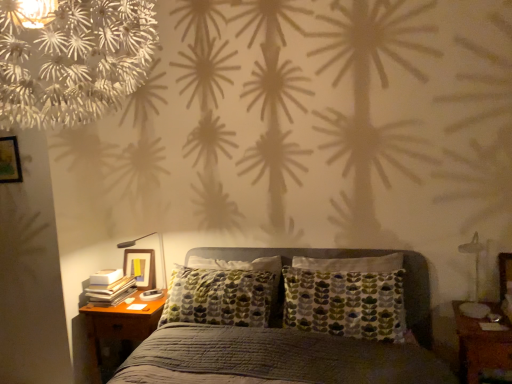
The height and width of the screenshot is (384, 512). In order to click on brown wooden nightstand at lower right, the first nightstand positioned from the right in this screenshot , I will do click(x=481, y=344).

In order to face matte black lamp at left, the 2th bedside lamp in the right-to-left sequence, should I rotate leftwards or rightwards?

Rotate your view left by about 15.663°.

Where is `wooden nightstand at lower left, placed as the 2th nightstand when sorted from front to back`? The width and height of the screenshot is (512, 384). wooden nightstand at lower left, placed as the 2th nightstand when sorted from front to back is located at coordinates point(119,326).

Image resolution: width=512 pixels, height=384 pixels. Describe the element at coordinates (119, 326) in the screenshot. I see `wooden nightstand at lower left, which ranks as the 1th nightstand in back-to-front order` at that location.

Locate an element on the screen. This screenshot has height=384, width=512. brown wooden nightstand at lower right, the first nightstand positioned from the front is located at coordinates (481, 344).

Which point is more distant from viewer, [471,380] or [257,359]?

The point [471,380] is farther.

Does brown wooden nightstand at lower right, which ranks as the second nightstand in back-to-front order, have a lesser height compared to textured gray bed at center?

Correct, brown wooden nightstand at lower right, which ranks as the second nightstand in back-to-front order, is not as tall as textured gray bed at center.

Considering the positions of objects brown wooden nightstand at lower right, the second nightstand when ordered from left to right, and textured gray bed at center in the image provided, who is in front, brown wooden nightstand at lower right, the second nightstand when ordered from left to right, or textured gray bed at center?

Positioned in front is textured gray bed at center.

The image size is (512, 384). Identify the location of picture frame to the left of matte black lamp at left, the 2th bedside lamp in the right-to-left sequence. (10, 160).

Between wooden picture frame at upper left and matte black lamp at left, the 2th bedside lamp in the right-to-left sequence, which one has larger width?

With larger width is matte black lamp at left, the 2th bedside lamp in the right-to-left sequence.

Is wooden picture frame at upper left aimed at matte black lamp at left, which is the first bedside lamp from left to right?

No, wooden picture frame at upper left is not aimed at matte black lamp at left, which is the first bedside lamp from left to right.

Does wooden picture frame at upper left have a smaller size compared to matte black lamp at left, which is the first bedside lamp from left to right?

Correct, wooden picture frame at upper left occupies less space than matte black lamp at left, which is the first bedside lamp from left to right.

Where is `flower that appears on the left of metallic silver bedside lamp at right, which ranks as the second bedside lamp in left-to-right order`? The height and width of the screenshot is (384, 512). flower that appears on the left of metallic silver bedside lamp at right, which ranks as the second bedside lamp in left-to-right order is located at coordinates (71, 58).

Is white paper flower at upper left next to metallic silver bedside lamp at right, which ranks as the second bedside lamp in left-to-right order?

No.

Does point (71, 53) come in front of point (482, 250)?

Yes, it is.

Is white paper flower at upper left turned away from metallic silver bedside lamp at right, which ranks as the second bedside lamp in left-to-right order?

white paper flower at upper left is not turned away from metallic silver bedside lamp at right, which ranks as the second bedside lamp in left-to-right order.

From the image's perspective, is wooden picture frame at upper left beneath brown wooden nightstand at lower right, the first nightstand positioned from the right?

No, from the image's perspective, wooden picture frame at upper left is not below brown wooden nightstand at lower right, the first nightstand positioned from the right.

Are wooden picture frame at upper left and brown wooden nightstand at lower right, the first nightstand positioned from the front, beside each other?

No, wooden picture frame at upper left is not making contact with brown wooden nightstand at lower right, the first nightstand positioned from the front.

Where is `picture frame that appears on the left of brown wooden nightstand at lower right, the second nightstand when ordered from left to right`? Image resolution: width=512 pixels, height=384 pixels. picture frame that appears on the left of brown wooden nightstand at lower right, the second nightstand when ordered from left to right is located at coordinates (10, 160).

Is wooden picture frame at upper left bigger or smaller than brown wooden nightstand at lower right, the first nightstand positioned from the front?

In the image, wooden picture frame at upper left appears to be smaller than brown wooden nightstand at lower right, the first nightstand positioned from the front.

From a real-world perspective, is textured gray bed at center below metallic silver bedside lamp at right, the 1th bedside lamp when ordered from front to back?

Correct, in the physical world, textured gray bed at center is lower than metallic silver bedside lamp at right, the 1th bedside lamp when ordered from front to back.

Which object is thinner, textured gray bed at center or metallic silver bedside lamp at right, the 1th bedside lamp when ordered from front to back?

metallic silver bedside lamp at right, the 1th bedside lamp when ordered from front to back.

Could you tell me if textured gray bed at center is facing metallic silver bedside lamp at right, the 1th bedside lamp when ordered from front to back?

No, textured gray bed at center does not turn towards metallic silver bedside lamp at right, the 1th bedside lamp when ordered from front to back.

Consider the image. Between textured gray bed at center and metallic silver bedside lamp at right, the 1th bedside lamp when ordered from front to back, which one has more height?

textured gray bed at center is taller.

Where is `nightstand that is the 1st object located below the matte black lamp at left, which ranks as the 2th bedside lamp in front-to-back order (from the image's perspective)`? nightstand that is the 1st object located below the matte black lamp at left, which ranks as the 2th bedside lamp in front-to-back order (from the image's perspective) is located at coordinates (481, 344).

Considering the relative sizes of matte black lamp at left, which is the first bedside lamp from left to right, and brown wooden nightstand at lower right, which ranks as the second nightstand in back-to-front order, in the image provided, is matte black lamp at left, which is the first bedside lamp from left to right, shorter than brown wooden nightstand at lower right, which ranks as the second nightstand in back-to-front order,?

Yes, matte black lamp at left, which is the first bedside lamp from left to right, is shorter than brown wooden nightstand at lower right, which ranks as the second nightstand in back-to-front order.

What's the angular difference between matte black lamp at left, the 2th bedside lamp in the right-to-left sequence, and brown wooden nightstand at lower right, the second nightstand when ordered from left to right,'s facing directions?

3.68 degrees.

Are matte black lamp at left, the 1th bedside lamp in the back-to-front sequence, and brown wooden nightstand at lower right, the first nightstand positioned from the right, far apart?

Yes, matte black lamp at left, the 1th bedside lamp in the back-to-front sequence, is far from brown wooden nightstand at lower right, the first nightstand positioned from the right.

Considering the sizes of objects wooden nightstand at lower left, placed as the 2th nightstand when sorted from front to back, and textured gray bed at center in the image provided, who is smaller, wooden nightstand at lower left, placed as the 2th nightstand when sorted from front to back, or textured gray bed at center?

Smaller between the two is wooden nightstand at lower left, placed as the 2th nightstand when sorted from front to back.

From a real-world perspective, which object stands above the other?

From a 3D spatial view, textured gray bed at center is above.

Between point (131, 329) and point (189, 343), which one is positioned behind?

The point (131, 329) is farther from the camera.

How much distance is there between wooden nightstand at lower left, the 2th nightstand positioned from the right, and textured gray bed at center?

A distance of 27.35 inches exists between wooden nightstand at lower left, the 2th nightstand positioned from the right, and textured gray bed at center.

Where is `nightstand above the textured gray bed at center (from the image's perspective)`? The image size is (512, 384). nightstand above the textured gray bed at center (from the image's perspective) is located at coordinates [481, 344].

There is a matte black lamp at left, the 2th bedside lamp in the right-to-left sequence. In order to click on picture frame above it (from a real-world perspective) in this screenshot , I will do click(x=10, y=160).

Looking at the image, which one is located further to wooden picture frame at upper left, matte black lamp at left, which is the first bedside lamp from left to right, or white paper flower at upper left?

white paper flower at upper left.

Based on their spatial positions, is wooden picture frame at upper left or metallic silver bedside lamp at right, the 1th bedside lamp when ordered from front to back, further from brown wooden nightstand at lower right, the second nightstand when ordered from left to right?

wooden picture frame at upper left.

Looking at this image, looking at the image, which one is located closer to metallic silver bedside lamp at right, the 1th bedside lamp when ordered from front to back, wooden picture frame at upper left or white paper flower at upper left?

Among the two, white paper flower at upper left is located nearer to metallic silver bedside lamp at right, the 1th bedside lamp when ordered from front to back.

When comparing their distances from brown wooden nightstand at lower right, the second nightstand when ordered from left to right, does wooden picture frame at upper left or matte black lamp at left, which ranks as the 2th bedside lamp in front-to-back order, seem further?

The object further to brown wooden nightstand at lower right, the second nightstand when ordered from left to right, is wooden picture frame at upper left.

Based on their spatial positions, is wooden nightstand at lower left, which appears as the 1th nightstand when viewed from the left, or white paper flower at upper left closer to matte black lamp at left, which is the first bedside lamp from left to right?

wooden nightstand at lower left, which appears as the 1th nightstand when viewed from the left, is positioned closer to the anchor matte black lamp at left, which is the first bedside lamp from left to right.

Considering their positions, is brown wooden nightstand at lower right, the second nightstand when ordered from left to right, positioned closer to metallic silver bedside lamp at right, the 1th bedside lamp when ordered from front to back, than white paper flower at upper left?

Based on the image, brown wooden nightstand at lower right, the second nightstand when ordered from left to right, appears to be nearer to metallic silver bedside lamp at right, the 1th bedside lamp when ordered from front to back.

Considering their positions, is white paper flower at upper left positioned closer to textured gray bed at center than matte black lamp at left, the 2th bedside lamp in the right-to-left sequence?

matte black lamp at left, the 2th bedside lamp in the right-to-left sequence, lies closer to textured gray bed at center than the other object.

Considering their positions, is wooden nightstand at lower left, placed as the 2th nightstand when sorted from front to back, positioned further to white paper flower at upper left than brown wooden nightstand at lower right, the first nightstand positioned from the right?

The object further to white paper flower at upper left is brown wooden nightstand at lower right, the first nightstand positioned from the right.

Identify the location of nightstand situated between wooden picture frame at upper left and metallic silver bedside lamp at right, the second bedside lamp positioned from the back, from left to right. (119, 326).

At what (x,y) coordinates should I click in order to perform the action: click on flower between textured gray bed at center and wooden nightstand at lower left, the 2th nightstand positioned from the right, from front to back. Please return your answer as a coordinate pair (x, y). The height and width of the screenshot is (384, 512). Looking at the image, I should click on (71, 58).

Identify the location of flower between wooden picture frame at upper left and brown wooden nightstand at lower right, the first nightstand positioned from the right, in the horizontal direction. This screenshot has height=384, width=512. (71, 58).

Image resolution: width=512 pixels, height=384 pixels. Find the location of `flower between textured gray bed at center and matte black lamp at left, the 1th bedside lamp in the back-to-front sequence, along the z-axis`. flower between textured gray bed at center and matte black lamp at left, the 1th bedside lamp in the back-to-front sequence, along the z-axis is located at coordinates (71, 58).